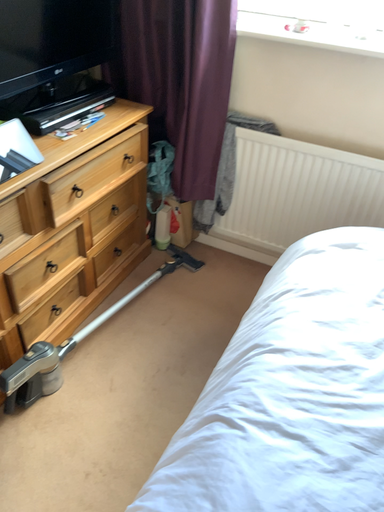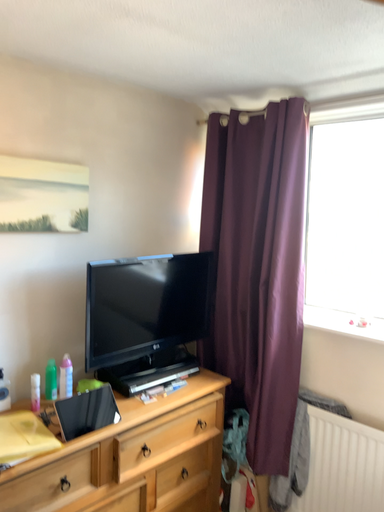
Question: How did the camera likely rotate when shooting the video?

Choices:
 (A) rotated left
 (B) rotated right

Answer: (A)